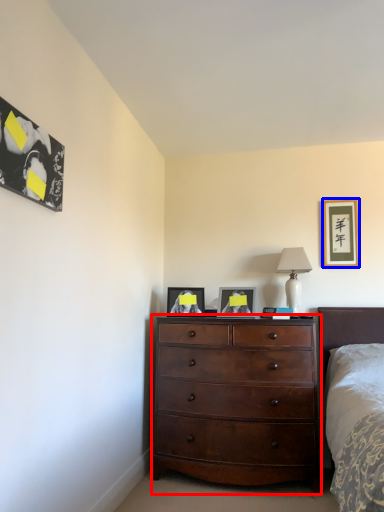
Question: Which object appears closest to the camera in this image, chest of drawers (highlighted by a red box) or picture frame (highlighted by a blue box)?

Choices:
 (A) chest of drawers
 (B) picture frame

Answer: (A)